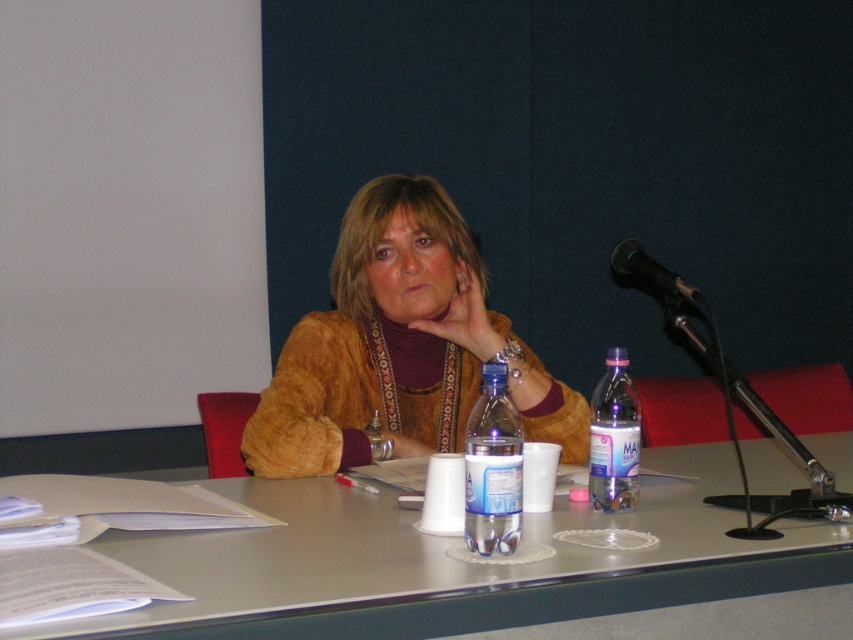
What is located at the point with coordinates (492, 467) on the table?

The point at coordinates (492, 467) marks the location of the translucent plastic bottle at center.